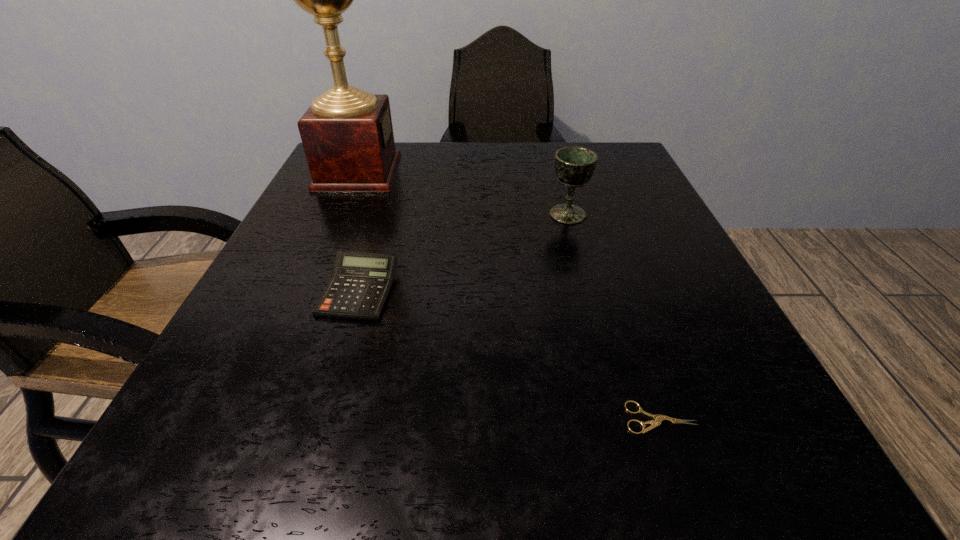
The width and height of the screenshot is (960, 540). Identify the location of object that is at the far edge. (347, 134).

Find the location of a particular element. The image size is (960, 540). object located in the near edge section of the desktop is located at coordinates (658, 419).

Image resolution: width=960 pixels, height=540 pixels. What are the coordinates of `trophy cup present at the left edge` in the screenshot? It's located at (347, 134).

Locate an element on the screen. This screenshot has width=960, height=540. calculator that is at the left edge is located at coordinates (360, 284).

The width and height of the screenshot is (960, 540). What are the coordinates of `chalice located in the right edge section of the desktop` in the screenshot? It's located at (574, 166).

Where is `shears that is at the right edge`? shears that is at the right edge is located at coordinates (658, 419).

The image size is (960, 540). Find the location of `object that is positioned at the far left corner`. object that is positioned at the far left corner is located at coordinates (347, 134).

Locate an element on the screen. The width and height of the screenshot is (960, 540). object that is at the near right corner is located at coordinates (658, 419).

The width and height of the screenshot is (960, 540). In order to click on vacant space at the far edge of the desktop in this screenshot , I will do `click(447, 147)`.

In the image, there is a desktop. At what (x,y) coordinates should I click in order to perform the action: click on vacant space at the near edge. Please return your answer as a coordinate pair (x, y). Looking at the image, I should click on (650, 454).